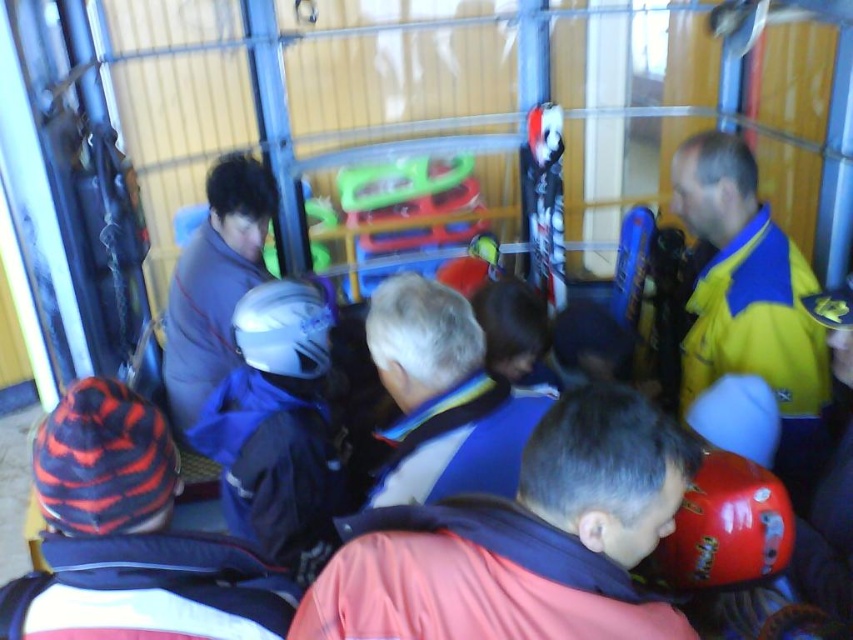
Question: Which of the following is the closest to the observer?

Choices:
 (A) white matte helmet at center
 (B) striped knit hat at lower left

Answer: (B)

Question: Which is farther from the shiny red helmet at lower right?

Choices:
 (A) white matte helmet at center
 (B) yellow/blue jacket at right
 (C) blue fleece jacket at center

Answer: (A)

Question: Does striped knit hat at lower left appear under white matte helmet at center?

Choices:
 (A) no
 (B) yes

Answer: (B)

Question: Is the position of gray fabric jacket at center more distant than that of shiny red helmet at lower right?

Choices:
 (A) yes
 (B) no

Answer: (A)

Question: Among these points, which one is farthest from the camera?

Choices:
 (A) (784, 285)
 (B) (218, 333)

Answer: (B)

Question: Is shiny red helmet at lower right thinner than blue matte helmet at center?

Choices:
 (A) no
 (B) yes

Answer: (A)